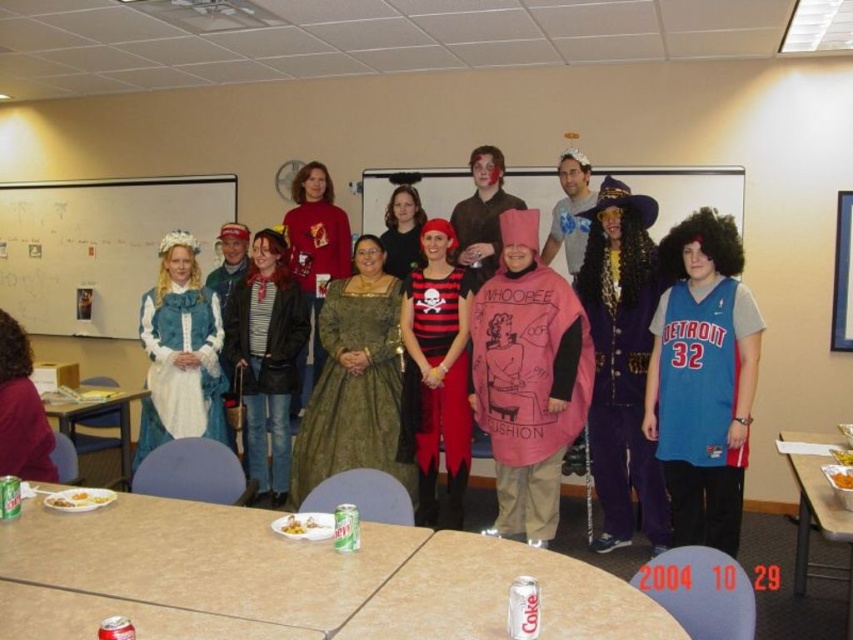
Question: Among these objects, which one is nearest to the camera?

Choices:
 (A) purple velvet suit at center
 (B) pink fabric costume at center
 (C) pink fabric hat at center

Answer: (B)

Question: Is smooth beige table at center to the left of matte white dress at lower left from the viewer's perspective?

Choices:
 (A) yes
 (B) no

Answer: (B)

Question: In this image, where is metallic silver table at center located relative to purple velvet suit at center?

Choices:
 (A) above
 (B) below

Answer: (B)

Question: Which of these objects is positioned farthest from the black leather jacket at center?

Choices:
 (A) white paperboard at center
 (B) matte blue fabric dress at center

Answer: (A)

Question: Estimate the real-world distances between objects in this image. Which object is farther from the metallic silver tray at lower right?

Choices:
 (A) black matte dress at center
 (B) smooth plastic table at lower left
 (C) smooth beige table at center

Answer: (B)

Question: Where is purple velvet suit at center located in relation to matte blue fabric dress at center in the image?

Choices:
 (A) left
 (B) right

Answer: (B)